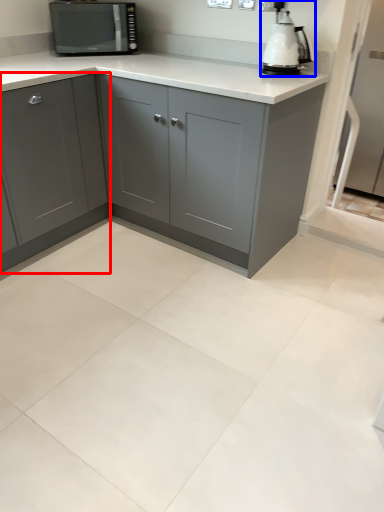
Question: Among these objects, which one is farthest to the camera, cabinetry (highlighted by a red box) or home appliance (highlighted by a blue box)?

Choices:
 (A) cabinetry
 (B) home appliance

Answer: (B)